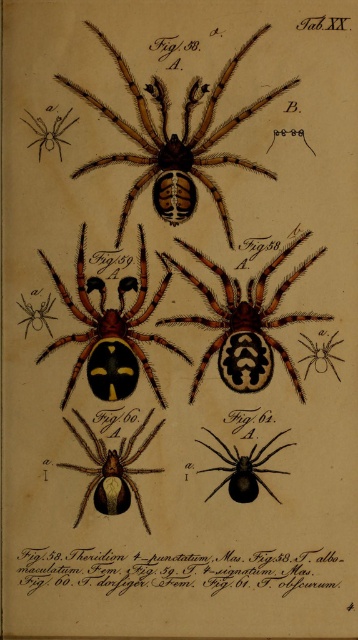
Question: Is brown glossy spider at lower left further to camera compared to matte black spider at upper left?

Choices:
 (A) no
 (B) yes

Answer: (A)

Question: Which object is the farthest from the black matte spider at center?

Choices:
 (A) black glossy spider at center
 (B) matte black spider at upper left

Answer: (B)

Question: Which of the following is the farthest from the observer?

Choices:
 (A) matte black spider at upper left
 (B) shiny orange spider at center
 (C) black matte spider at center

Answer: (A)

Question: In this image, where is black paper text at lower center located relative to brown glossy spider at lower left?

Choices:
 (A) above
 (B) below

Answer: (B)

Question: Which point is closer to the camera?

Choices:
 (A) (191, 195)
 (B) (224, 333)

Answer: (B)

Question: Is black glossy spider at center to the left of shiny orange spider at center from the viewer's perspective?

Choices:
 (A) no
 (B) yes

Answer: (A)